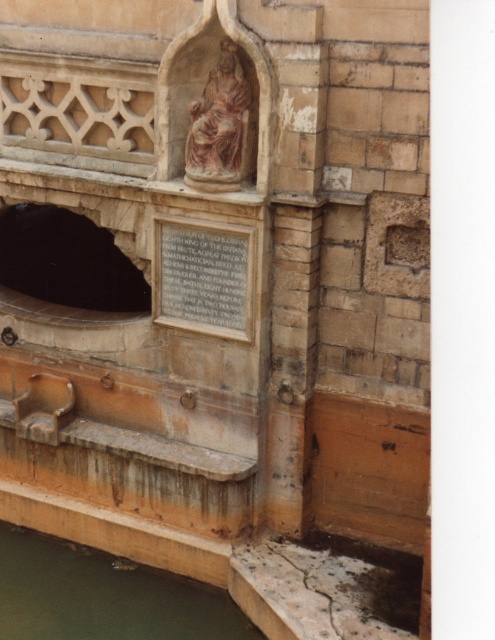
Question: Based on their relative distances, which object is nearer to the matte stone plaque at center?

Choices:
 (A) black stone hole at lower left
 (B) matte pink stone statue at center
 (C) greenish murky water at lower left

Answer: (B)

Question: Does matte stone plaque at center appear over matte pink stone statue at center?

Choices:
 (A) no
 (B) yes

Answer: (A)

Question: Observing the image, what is the correct spatial positioning of black stone hole at lower left in reference to matte stone plaque at center?

Choices:
 (A) left
 (B) right

Answer: (A)

Question: Which point is closer to the camera taking this photo?

Choices:
 (A) (55, 212)
 (B) (188, 147)
 (C) (190, 268)

Answer: (B)

Question: Among these objects, which one is nearest to the camera?

Choices:
 (A) matte pink stone statue at center
 (B) black stone hole at lower left
 (C) greenish murky water at lower left
 (D) matte stone plaque at center

Answer: (A)

Question: Can you confirm if matte stone plaque at center is thinner than matte pink stone statue at center?

Choices:
 (A) yes
 (B) no

Answer: (B)